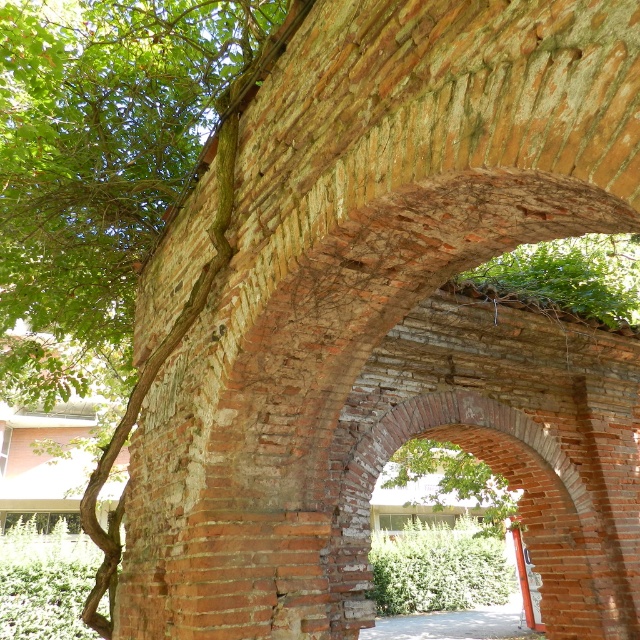
Question: Which point is closer to the camera?

Choices:
 (A) (60, 168)
 (B) (504, 497)
 (C) (525, 595)

Answer: (A)

Question: Does green leafy tree at upper left have a greater width compared to orange painted wood post at center?

Choices:
 (A) yes
 (B) no

Answer: (A)

Question: Observing the image, what is the correct spatial positioning of green leafy tree at upper left in reference to green leafy tree at center?

Choices:
 (A) right
 (B) left

Answer: (B)

Question: Which point is closer to the camera taking this photo?

Choices:
 (A) (513, 531)
 (B) (432, 467)

Answer: (B)

Question: Does green leafy tree at upper left appear on the right side of orange painted wood post at center?

Choices:
 (A) no
 (B) yes

Answer: (A)

Question: Which of the following is the farthest from the observer?

Choices:
 (A) (522, 568)
 (B) (392, 472)

Answer: (B)